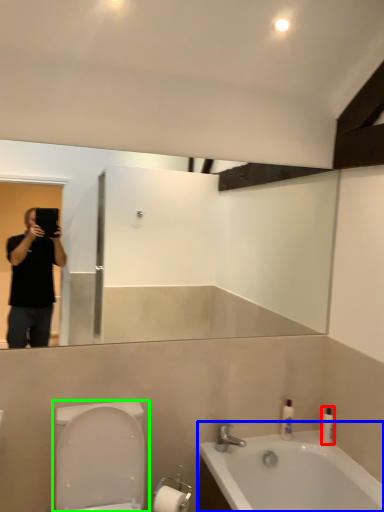
Question: Which is farther away from toiletry (highlighted by a red box)? bathtub (highlighted by a blue box) or toilet (highlighted by a green box)?

Choices:
 (A) bathtub
 (B) toilet

Answer: (B)